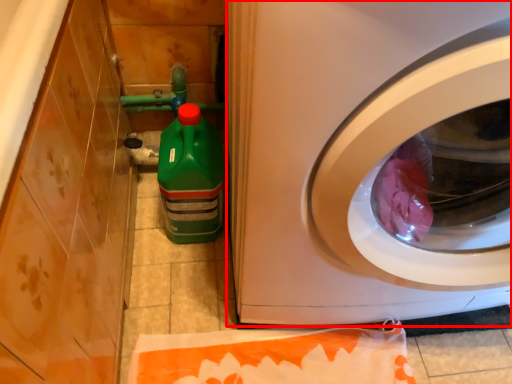
Question: Where is washing machine (annotated by the red box) located in relation to cleaning product in the image?

Choices:
 (A) left
 (B) right

Answer: (B)